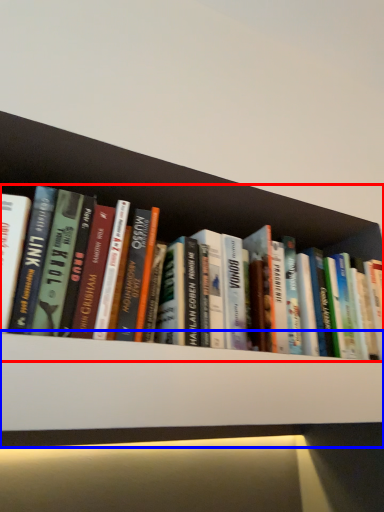
Question: Among these objects, which one is nearest to the camera, book (highlighted by a red box) or shelf (highlighted by a blue box)?

Choices:
 (A) book
 (B) shelf

Answer: (B)